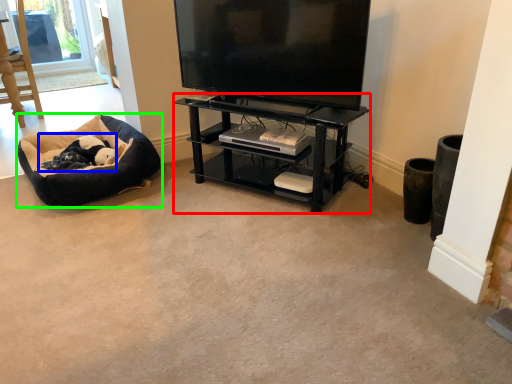
Question: Which object is positioned closest to shelf (highlighted by a red box)? Select from animal (highlighted by a blue box) and dog bed (highlighted by a green box).

Choices:
 (A) animal
 (B) dog bed

Answer: (B)